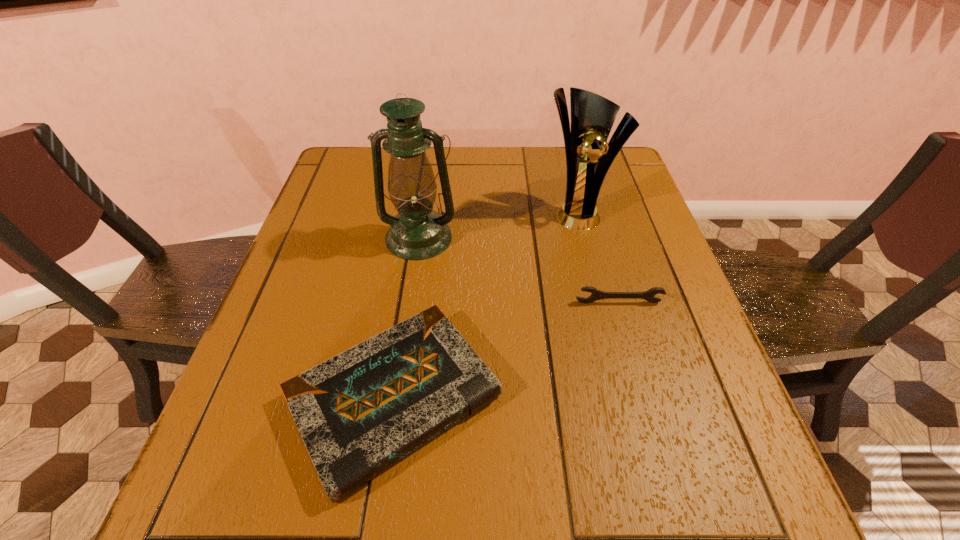
Locate an element on the screen. free point between the wrench and the oil lamp is located at coordinates (518, 270).

Where is `free space between the wrench and the notebook`? The image size is (960, 540). free space between the wrench and the notebook is located at coordinates (506, 350).

At what (x,y) coordinates should I click in order to perform the action: click on free space between the oil lamp and the nearest object. Please return your answer as a coordinate pair (x, y). This screenshot has height=540, width=960. Looking at the image, I should click on (406, 318).

You are a GUI agent. You are given a task and a screenshot of the screen. Output one action in this format:
    pyautogui.click(x=<x>, y=<y>)
    Task: Click on the free space between the award and the wrench
    This screenshot has height=540, width=960.
    Given the screenshot: What is the action you would take?
    pyautogui.click(x=597, y=257)

What are the coordinates of `free space between the notebook and the award` in the screenshot? It's located at (485, 305).

This screenshot has width=960, height=540. In order to click on vacant space that's between the oil lamp and the wrench in this screenshot , I will do `click(518, 270)`.

In order to click on free area in between the second nearest object and the notebook in this screenshot , I will do `click(506, 350)`.

In order to click on vacant area that lies between the wrench and the oil lamp in this screenshot , I will do `click(518, 270)`.

The height and width of the screenshot is (540, 960). Find the location of `empty space between the award and the nearest object`. empty space between the award and the nearest object is located at coordinates (485, 305).

Identify which object is the closest to the oil lamp. Please provide its 2D coordinates. Your answer should be formatted as a tuple, i.e. [(x, y)], where the tuple contains the x and y coordinates of a point satisfying the conditions above.

[(359, 412)]